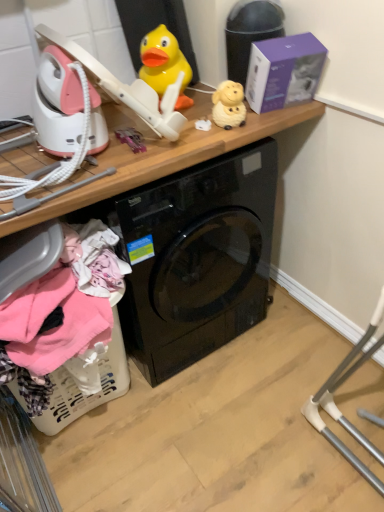
Where is `free spot to the right of matte yellow sheep at upper center, positioned as the first toy in right-to-left order`? free spot to the right of matte yellow sheep at upper center, positioned as the first toy in right-to-left order is located at coordinates (276, 116).